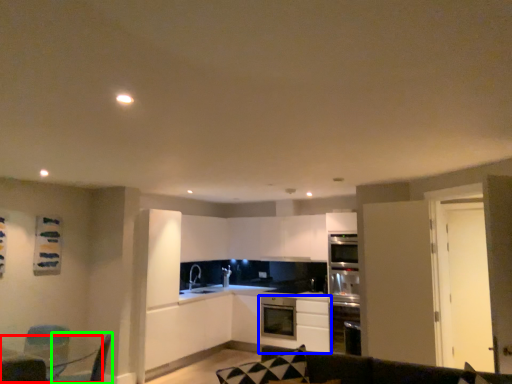
Question: Based on their relative distances, which object is farther from table (highlighted by a red box)? Choose from cabinetry (highlighted by a blue box) and swivel chair (highlighted by a green box).

Choices:
 (A) cabinetry
 (B) swivel chair

Answer: (A)